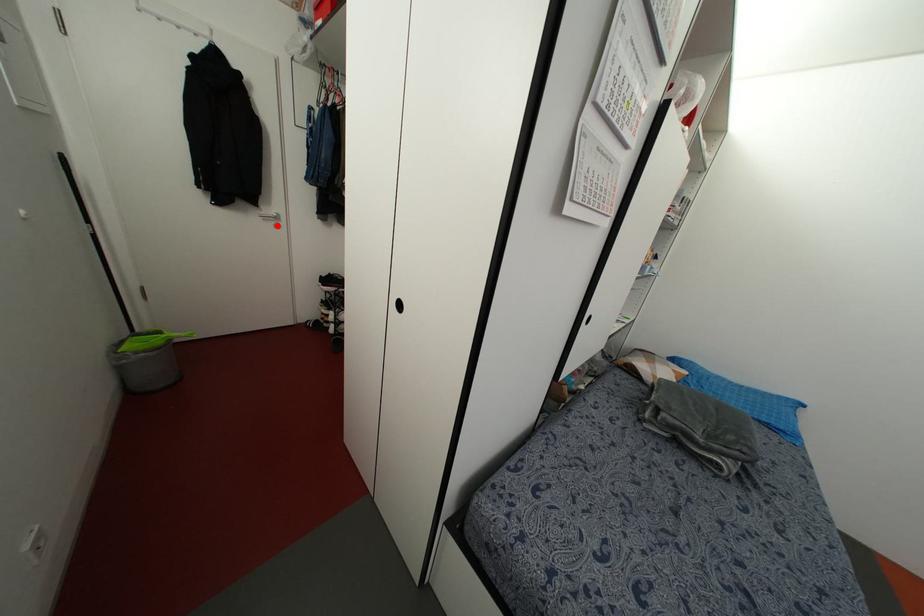
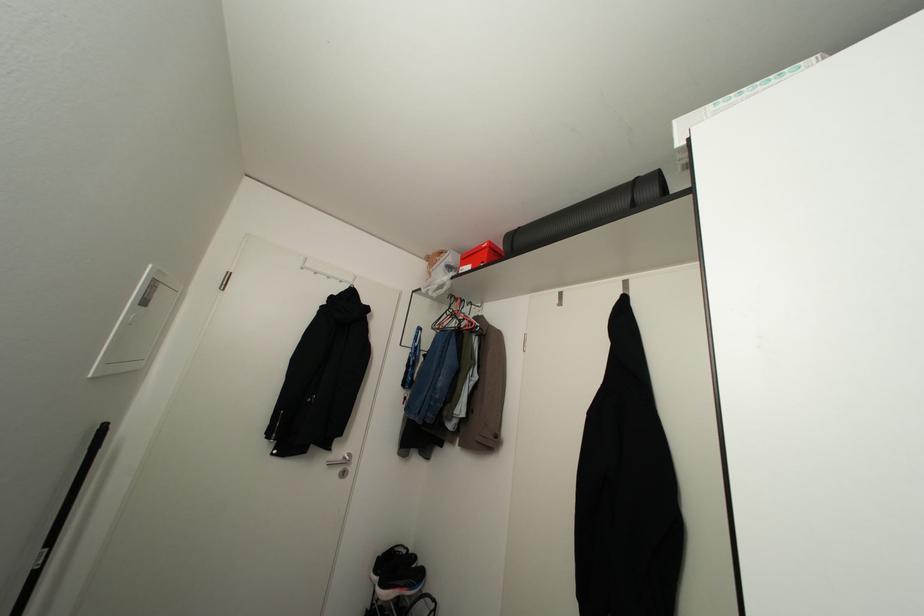
Find the pixel in the second image that matches the highlighted location in the first image.

(343, 472)